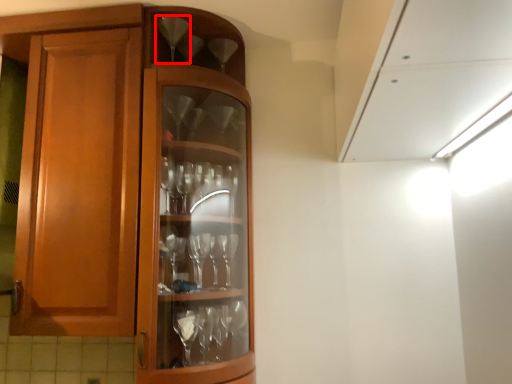
Question: From the image's perspective, what is the correct spatial positioning of wine glass (annotated by the red box) in reference to wine glass?

Choices:
 (A) below
 (B) above

Answer: (B)